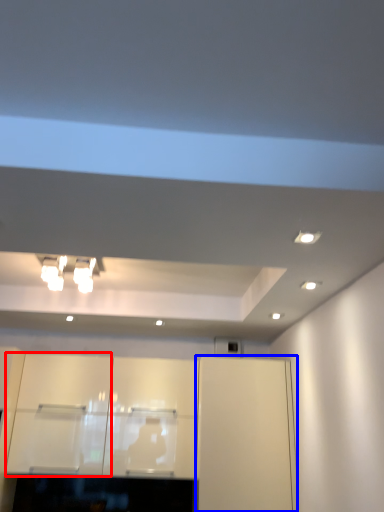
Question: Which point is closer to the camera, cabinetry (highlighted by a red box) or cabinetry (highlighted by a blue box)?

Choices:
 (A) cabinetry
 (B) cabinetry

Answer: (B)